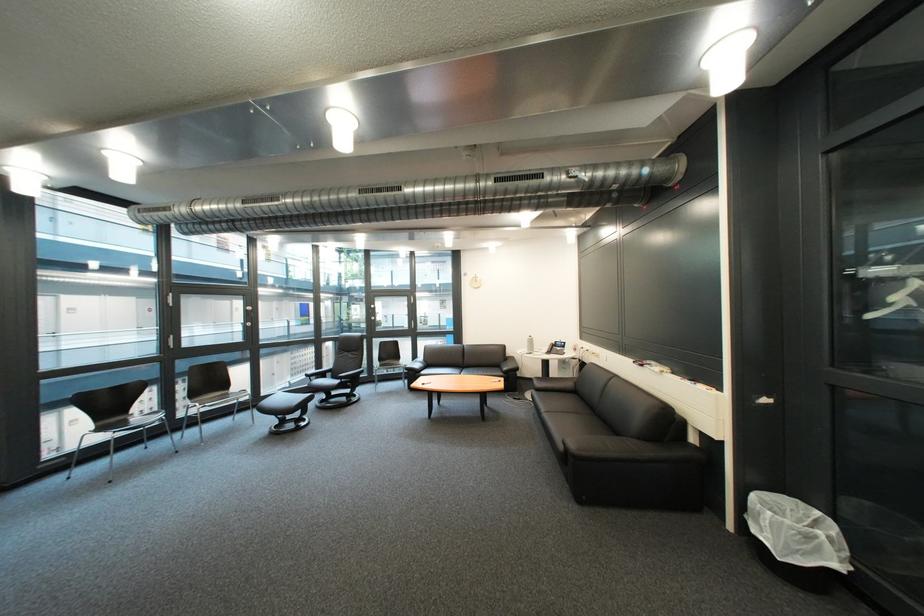
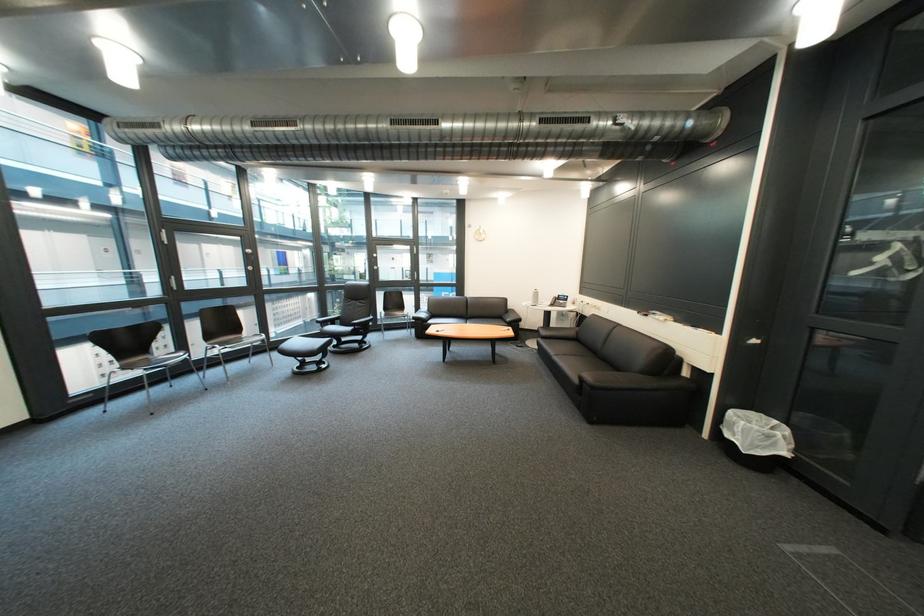
Where in the second image is the point corresponding to point (552, 392) from the first image?

(556, 339)